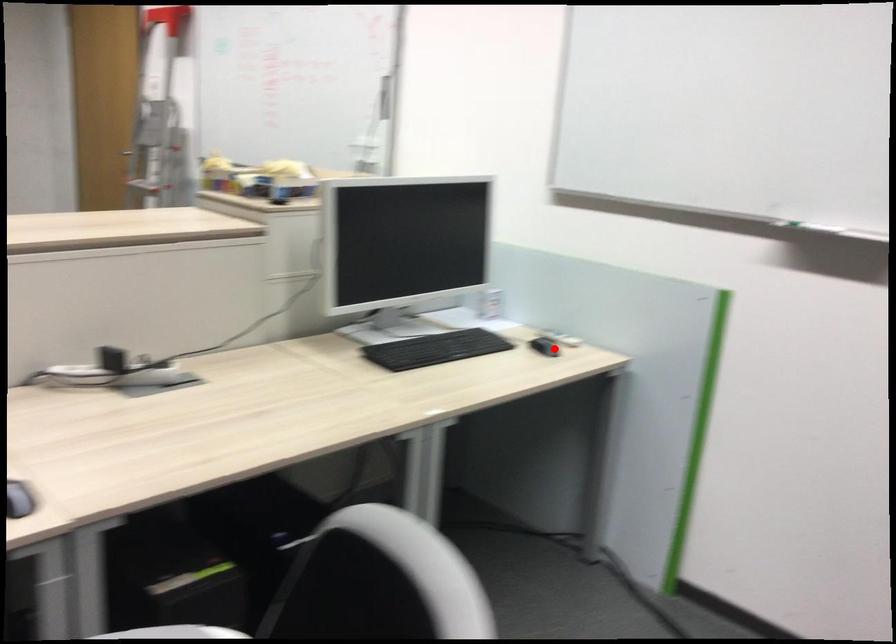
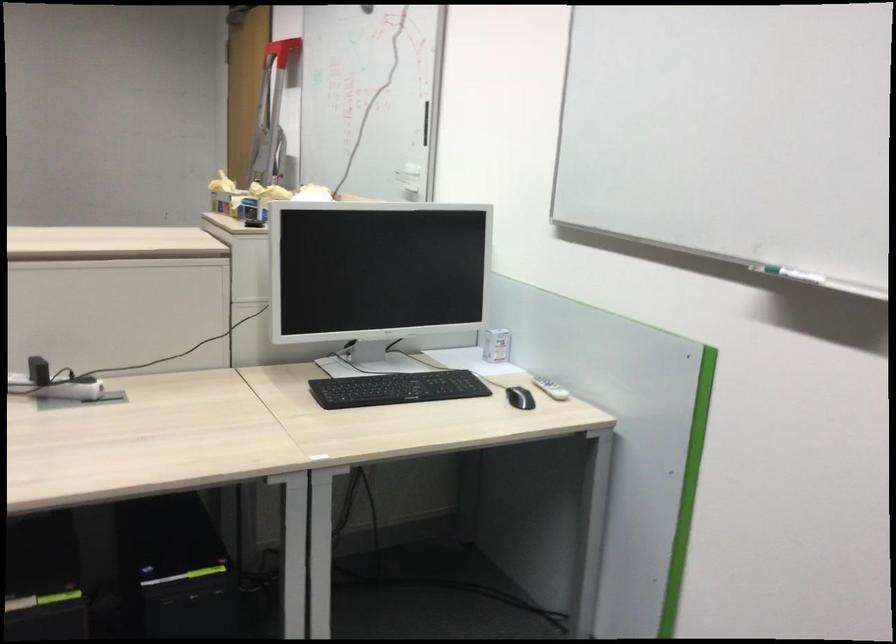
Question: I am providing you with two images of the same scene from different viewpoints. Given a red point in image1, look at the same physical point in image2. Is it:

Choices:
 (A) Closer to the viewpoint
 (B) Farther from the viewpoint

Answer: (A)